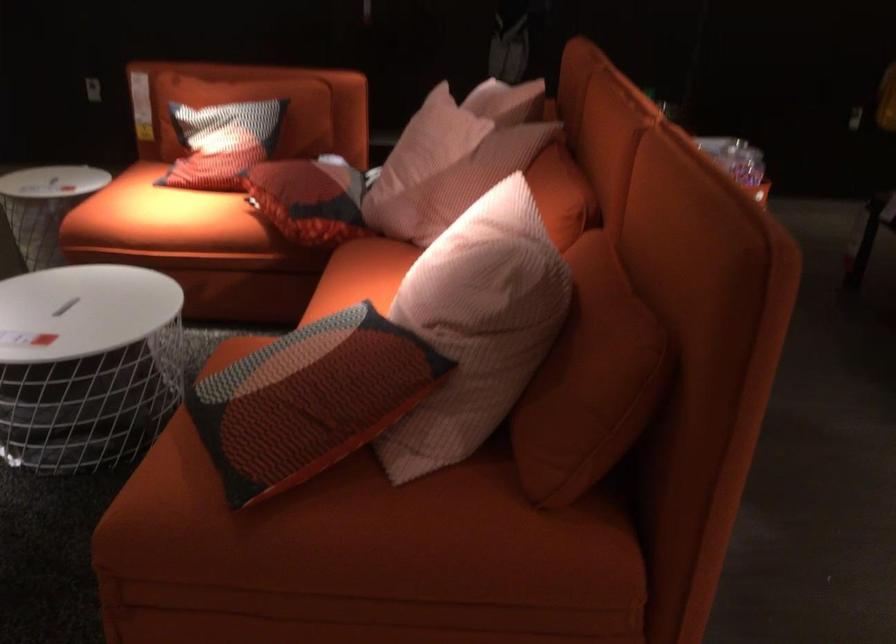
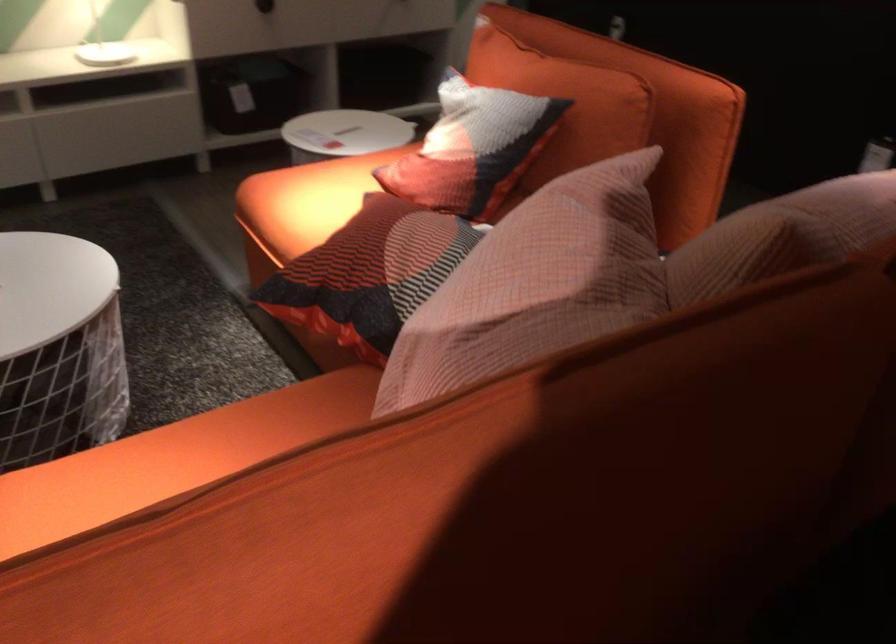
Find the pixel in the second image that matches pixel 282 102 in the first image.

(564, 102)